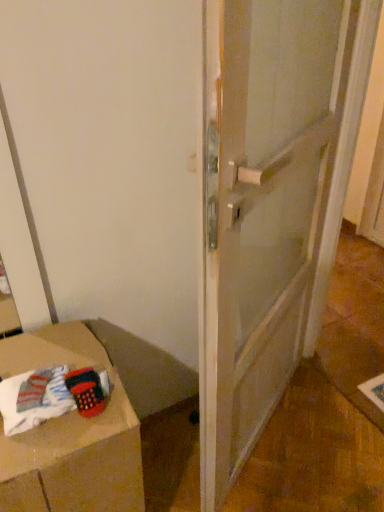
What do you see at coordinates (261, 208) in the screenshot? I see `transparent glass door at center` at bounding box center [261, 208].

Locate an element on the screen. This screenshot has height=512, width=384. transparent glass door at center is located at coordinates (261, 208).

Describe the element at coordinates (34, 399) in the screenshot. I see `white soft fabric at lower left` at that location.

Find the location of a particular element. transparent glass door at center is located at coordinates (261, 208).

Considering the positions of objects knitted fabric basket at lower left and white soft fabric at lower left in the image provided, who is behind, knitted fabric basket at lower left or white soft fabric at lower left?

white soft fabric at lower left.

Could you tell me if knitted fabric basket at lower left is turned towards white soft fabric at lower left?

No, knitted fabric basket at lower left does not turn towards white soft fabric at lower left.

Considering the sizes of knitted fabric basket at lower left and white soft fabric at lower left in the image, is knitted fabric basket at lower left wider or thinner than white soft fabric at lower left?

Clearly, knitted fabric basket at lower left has more width compared to white soft fabric at lower left.

Can you confirm if knitted fabric basket at lower left is smaller than white soft fabric at lower left?

Actually, knitted fabric basket at lower left might be larger than white soft fabric at lower left.

Which object is positioned more to the right, transparent glass door at center or white soft fabric at lower left?

Positioned to the right is transparent glass door at center.

The width and height of the screenshot is (384, 512). Find the location of `laundry below the transparent glass door at center (from the image's perspective)`. laundry below the transparent glass door at center (from the image's perspective) is located at coordinates (34, 399).

Considering the relative sizes of transparent glass door at center and white soft fabric at lower left in the image provided, is transparent glass door at center taller than white soft fabric at lower left?

Indeed, transparent glass door at center has a greater height compared to white soft fabric at lower left.

Is transparent glass door at center positioned far away from white soft fabric at lower left?

They are positioned close to each other.

Is point (95, 362) positioned behind point (216, 433)?

No, it is not.

Is knitted fabric basket at lower left facing away from transparent glass door at center?

knitted fabric basket at lower left does not have its back to transparent glass door at center.

From a real-world perspective, is knitted fabric basket at lower left physically below transparent glass door at center?

Yes, from a real-world perspective, knitted fabric basket at lower left is beneath transparent glass door at center.

Which of these two, knitted fabric basket at lower left or transparent glass door at center, is bigger?

Bigger between the two is transparent glass door at center.

Can you tell me how much white soft fabric at lower left and knitted fabric basket at lower left differ in facing direction?

2.89 degrees.

Is white soft fabric at lower left bigger than knitted fabric basket at lower left?

Actually, white soft fabric at lower left might be smaller than knitted fabric basket at lower left.

Between point (65, 409) and point (117, 423), which one is positioned behind?

The point (117, 423) is more distant.

Which object is closer to the camera, white soft fabric at lower left or knitted fabric basket at lower left?

knitted fabric basket at lower left is closer to the camera.

Is white soft fabric at lower left not within transparent glass door at center?

white soft fabric at lower left is positioned outside transparent glass door at center.

From a real-world perspective, between white soft fabric at lower left and transparent glass door at center, who is vertically higher?

transparent glass door at center is physically above.

Consider the image. Considering the relative positions of white soft fabric at lower left and transparent glass door at center in the image provided, is white soft fabric at lower left behind transparent glass door at center?

Yes, white soft fabric at lower left is behind transparent glass door at center.

From the image's perspective, is white soft fabric at lower left on transparent glass door at center?

No, from the image's perspective, white soft fabric at lower left is not over transparent glass door at center.

Is transparent glass door at center next to knitted fabric basket at lower left and touching it?

transparent glass door at center and knitted fabric basket at lower left are not in contact.

In the image, is transparent glass door at center positioned in front of or behind knitted fabric basket at lower left?

Visually, transparent glass door at center is located in front of knitted fabric basket at lower left.

Is transparent glass door at center smaller than knitted fabric basket at lower left?

No.

This screenshot has height=512, width=384. What are the coordinates of `furniture below the white soft fabric at lower left (from the image's perspective)` in the screenshot? It's located at (73, 433).

At what (x,y) coordinates should I click in order to perform the action: click on door that is above the white soft fabric at lower left (from the image's perspective). Please return your answer as a coordinate pair (x, y). This screenshot has height=512, width=384. Looking at the image, I should click on (261, 208).

When comparing their distances from white soft fabric at lower left, does knitted fabric basket at lower left or transparent glass door at center seem closer?

Based on the image, knitted fabric basket at lower left appears to be nearer to white soft fabric at lower left.

Estimate the real-world distances between objects in this image. Which object is closer to transparent glass door at center, white soft fabric at lower left or knitted fabric basket at lower left?

knitted fabric basket at lower left lies closer to transparent glass door at center than the other object.

Considering their positions, is transparent glass door at center positioned further to knitted fabric basket at lower left than white soft fabric at lower left?

transparent glass door at center.

Estimate the real-world distances between objects in this image. Which object is closer to knitted fabric basket at lower left, white soft fabric at lower left or transparent glass door at center?

white soft fabric at lower left lies closer to knitted fabric basket at lower left than the other object.

When comparing their distances from white soft fabric at lower left, does transparent glass door at center or knitted fabric basket at lower left seem further?

Among the two, transparent glass door at center is located further to white soft fabric at lower left.

When comparing their distances from transparent glass door at center, does knitted fabric basket at lower left or white soft fabric at lower left seem closer?

knitted fabric basket at lower left is closer to transparent glass door at center.

Locate an element on the screen. laundry between knitted fabric basket at lower left and transparent glass door at center in the horizontal direction is located at coordinates (34, 399).